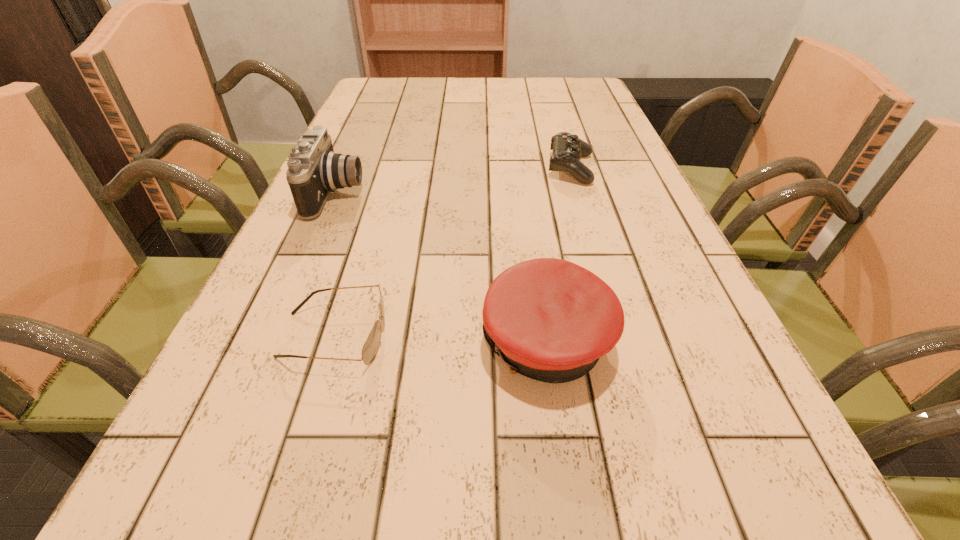
You are a GUI agent. You are given a task and a screenshot of the screen. Output one action in this format:
    pyautogui.click(x=<x>, y=<y>)
    Task: Click on the camera at the left edge
    
    Given the screenshot: What is the action you would take?
    pyautogui.click(x=314, y=170)

The height and width of the screenshot is (540, 960). In order to click on sunglasses located at the left edge in this screenshot , I will do `click(370, 348)`.

At what (x,y) coordinates should I click in order to perform the action: click on object positioned at the right edge. Please return your answer as a coordinate pair (x, y). This screenshot has width=960, height=540. Looking at the image, I should click on (568, 149).

Locate an element on the screen. vacant space at the far edge is located at coordinates (468, 78).

The height and width of the screenshot is (540, 960). I want to click on free region at the left edge, so click(x=252, y=381).

Find the location of a particular element. This screenshot has width=960, height=540. vacant space at the right edge of the desktop is located at coordinates (727, 535).

I want to click on free space at the far left corner of the desktop, so click(400, 89).

In the image, there is a desktop. Identify the location of vacant space at the far right corner. (556, 105).

Find the location of a particular element. The width and height of the screenshot is (960, 540). free space between the second shortest object and the tallest object is located at coordinates (454, 181).

I want to click on vacant area that lies between the control and the tallest object, so click(454, 181).